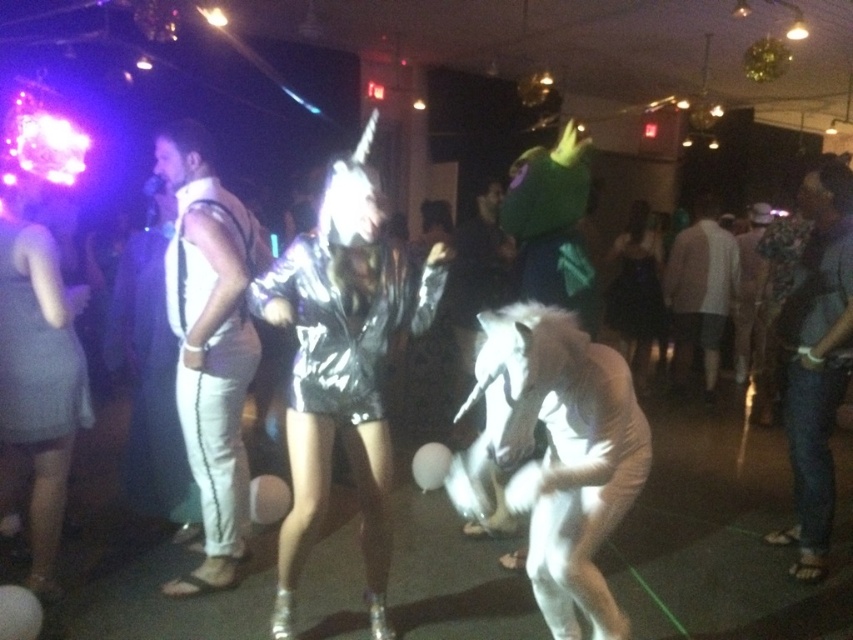
Who is more forward, (206, 435) or (73, 376)?

Positioned in front is point (73, 376).

Who is higher up, white matte pants at left or matte gray dress at left?

matte gray dress at left is above.

Find the location of `white matte pants at left`. white matte pants at left is located at coordinates (210, 344).

What do you see at coordinates (35, 360) in the screenshot?
I see `matte gray dress at left` at bounding box center [35, 360].

Can you confirm if matte gray dress at left is thinner than white furry costume at center?

Yes, matte gray dress at left is thinner than white furry costume at center.

Identify the location of matte gray dress at left. (35, 360).

This screenshot has width=853, height=640. Describe the element at coordinates (210, 344) in the screenshot. I see `white matte pants at left` at that location.

Does point (166, 140) come behind point (674, 348)?

No, it is in front of (674, 348).

Which is behind, point (229, 259) or point (703, 243)?

The point (703, 243) is behind.

Find the location of `white matte pants at left`. white matte pants at left is located at coordinates (210, 344).